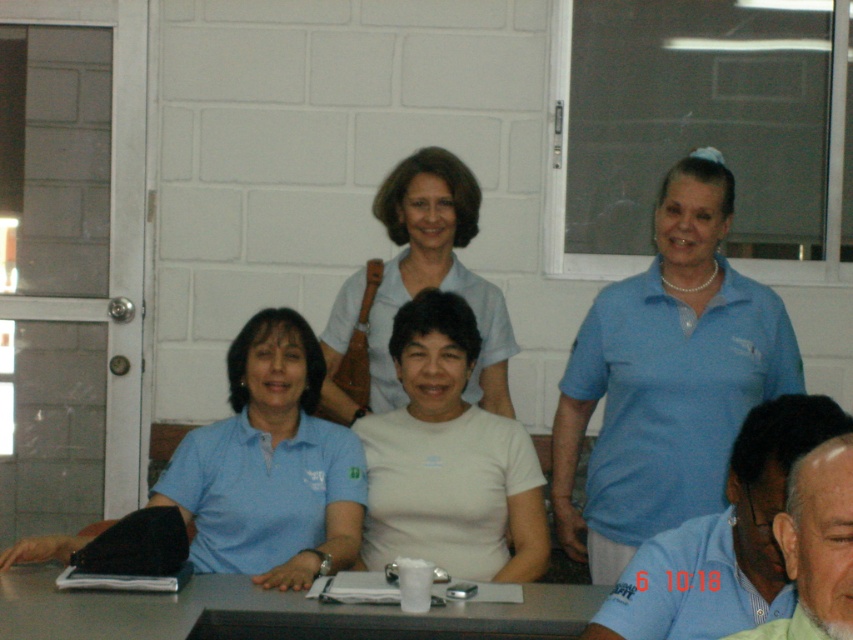
Looking at this image, between metallic gray table at center and green shirt at lower right, which one is positioned lower?

metallic gray table at center

What do you see at coordinates (270, 612) in the screenshot? The image size is (853, 640). I see `metallic gray table at center` at bounding box center [270, 612].

Locate an element on the screen. metallic gray table at center is located at coordinates (270, 612).

Between blue shirt at center and light blue shirt at center, which one appears on the right side from the viewer's perspective?

From the viewer's perspective, blue shirt at center appears more on the right side.

Is point (759, 545) closer to viewer compared to point (463, 230)?

Yes.

In order to click on blue shirt at center in this screenshot , I will do `click(724, 538)`.

Is matte blue polo shirt at lower left shorter than light blue shirt at center?

Yes.

Which is above, matte blue polo shirt at lower left or light blue shirt at center?

Positioned higher is light blue shirt at center.

Where is `matte blue polo shirt at lower left`? The image size is (853, 640). matte blue polo shirt at lower left is located at coordinates (270, 467).